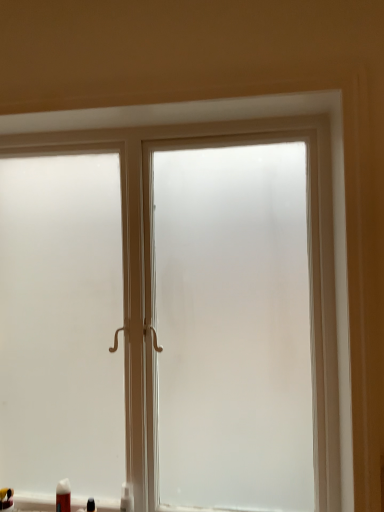
Question: Is matte black bottle at lower left, the 3th toiletry positioned from the left, next to white matte tube at lower left, acting as the 2th toiletry starting from the left, and touching it?

Choices:
 (A) yes
 (B) no

Answer: (B)

Question: Is matte black bottle at lower left, the 3th toiletry positioned from the left, further to camera compared to white matte tube at lower left, acting as the 2th toiletry starting from the left?

Choices:
 (A) no
 (B) yes

Answer: (A)

Question: Is matte black bottle at lower left, which ranks as the 2th toiletry in right-to-left order, closer to camera compared to white matte tube at lower left, acting as the 2th toiletry starting from the left?

Choices:
 (A) no
 (B) yes

Answer: (B)

Question: Is matte black bottle at lower left, the 3th toiletry positioned from the left, bigger than white matte tube at lower left, positioned as the 3th toiletry in right-to-left order?

Choices:
 (A) yes
 (B) no

Answer: (B)

Question: Considering the relative sizes of matte black bottle at lower left, which ranks as the 2th toiletry in right-to-left order, and white matte tube at lower left, acting as the 2th toiletry starting from the left, in the image provided, is matte black bottle at lower left, which ranks as the 2th toiletry in right-to-left order, shorter than white matte tube at lower left, acting as the 2th toiletry starting from the left,?

Choices:
 (A) no
 (B) yes

Answer: (B)

Question: Does matte black bottle at lower left, the 3th toiletry positioned from the left, have a greater width compared to white matte tube at lower left, positioned as the 3th toiletry in right-to-left order?

Choices:
 (A) yes
 (B) no

Answer: (B)

Question: Does frosted glass window at center have a larger size compared to matte black toothpaste tube at lower left, the first toiletry in the left-to-right sequence?

Choices:
 (A) no
 (B) yes

Answer: (B)

Question: Can you confirm if frosted glass window at center is smaller than matte black toothpaste tube at lower left, which is the fourth toiletry from right to left?

Choices:
 (A) yes
 (B) no

Answer: (B)

Question: From the image's perspective, is frosted glass window at center located beneath matte black toothpaste tube at lower left, the first toiletry in the left-to-right sequence?

Choices:
 (A) no
 (B) yes

Answer: (A)

Question: Does frosted glass window at center appear on the left side of matte black toothpaste tube at lower left, which is the fourth toiletry from right to left?

Choices:
 (A) yes
 (B) no

Answer: (B)

Question: Is frosted glass window at center far away from matte black toothpaste tube at lower left, the first toiletry in the left-to-right sequence?

Choices:
 (A) yes
 (B) no

Answer: (A)

Question: Is frosted glass window at center touching matte black toothpaste tube at lower left, which is the fourth toiletry from right to left?

Choices:
 (A) yes
 (B) no

Answer: (B)

Question: Can you confirm if white matte tube at lower left, acting as the 2th toiletry starting from the left, is taller than matte black toothpaste tube at lower left, which is the fourth toiletry from right to left?

Choices:
 (A) no
 (B) yes

Answer: (B)